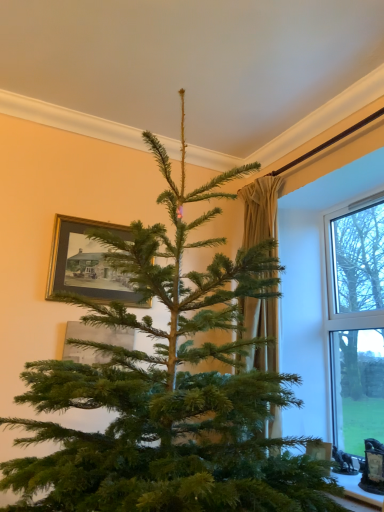
Question: Should I look upward or downward to see gold-framed picture at upper left, marked as the 1th picture frame in a bottom-to-top arrangement?

Choices:
 (A) down
 (B) up

Answer: (A)

Question: Is gold-framed picture at upper left, placed as the second picture frame when sorted from top to bottom, oriented towards beige fabric curtain at center?

Choices:
 (A) no
 (B) yes

Answer: (A)

Question: Is gold-framed picture at upper left, placed as the second picture frame when sorted from top to bottom, taller than beige fabric curtain at center?

Choices:
 (A) yes
 (B) no

Answer: (B)

Question: Is gold-framed picture at upper left, placed as the second picture frame when sorted from top to bottom, bigger than beige fabric curtain at center?

Choices:
 (A) no
 (B) yes

Answer: (A)

Question: Considering the relative positions of gold-framed picture at upper left, marked as the 1th picture frame in a bottom-to-top arrangement, and beige fabric curtain at center in the image provided, is gold-framed picture at upper left, marked as the 1th picture frame in a bottom-to-top arrangement, to the left of beige fabric curtain at center from the viewer's perspective?

Choices:
 (A) no
 (B) yes

Answer: (B)

Question: Are gold-framed picture at upper left, marked as the 1th picture frame in a bottom-to-top arrangement, and beige fabric curtain at center located far from each other?

Choices:
 (A) no
 (B) yes

Answer: (A)

Question: Can you confirm if gold-framed picture at upper left, placed as the second picture frame when sorted from top to bottom, is positioned to the right of beige fabric curtain at center?

Choices:
 (A) yes
 (B) no

Answer: (B)

Question: From the image's perspective, is transparent glass window at right on top of beige fabric curtain at center?

Choices:
 (A) yes
 (B) no

Answer: (A)

Question: Is transparent glass window at right positioned far away from beige fabric curtain at center?

Choices:
 (A) no
 (B) yes

Answer: (A)

Question: Does transparent glass window at right come behind beige fabric curtain at center?

Choices:
 (A) yes
 (B) no

Answer: (B)

Question: Is transparent glass window at right taller than beige fabric curtain at center?

Choices:
 (A) yes
 (B) no

Answer: (A)

Question: Is transparent glass window at right closer to camera compared to beige fabric curtain at center?

Choices:
 (A) yes
 (B) no

Answer: (A)

Question: Can you confirm if transparent glass window at right is positioned to the right of beige fabric curtain at center?

Choices:
 (A) no
 (B) yes

Answer: (B)

Question: From the image's perspective, would you say white plastic window at right is shown under gold-framed picture at upper left, positioned as the 1th picture frame in top-to-bottom order?

Choices:
 (A) yes
 (B) no

Answer: (A)